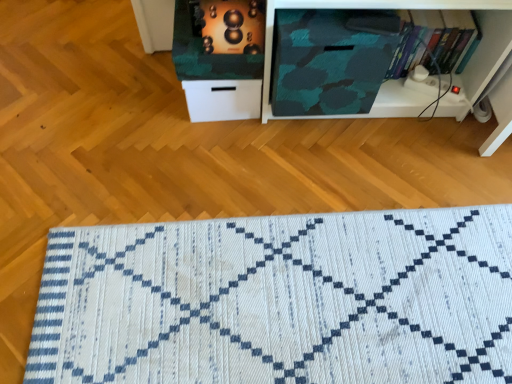
Question: Looking at their shapes, would you say hardcover book at upper right is wider or thinner than metallic gold speaker at upper center?

Choices:
 (A) thin
 (B) wide

Answer: (A)

Question: From the image's perspective, relative to metallic gold speaker at upper center, is hardcover book at upper right above or below?

Choices:
 (A) above
 (B) below

Answer: (B)

Question: Which object is positioned farthest from the hardcover book at upper right?

Choices:
 (A) metallic gold speaker at upper center
 (B) camouflage fabric cabinet at center
 (C) white woven mat at lower center
 (D) camouflage fabric at center

Answer: (C)

Question: Which object is the farthest from the hardcover book at upper right?

Choices:
 (A) metallic gold speaker at upper center
 (B) white woven mat at lower center
 (C) camouflage fabric at center
 (D) camouflage fabric cabinet at center

Answer: (B)